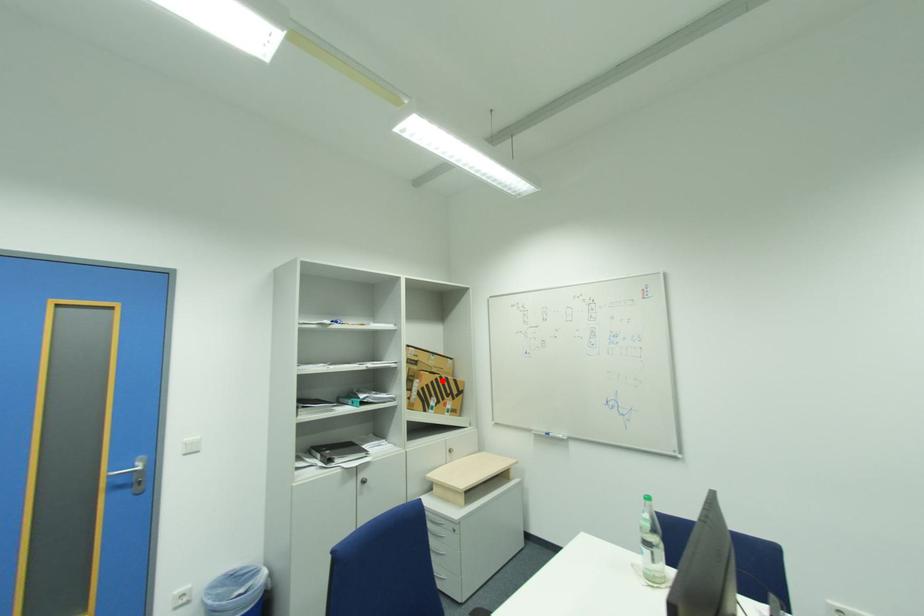
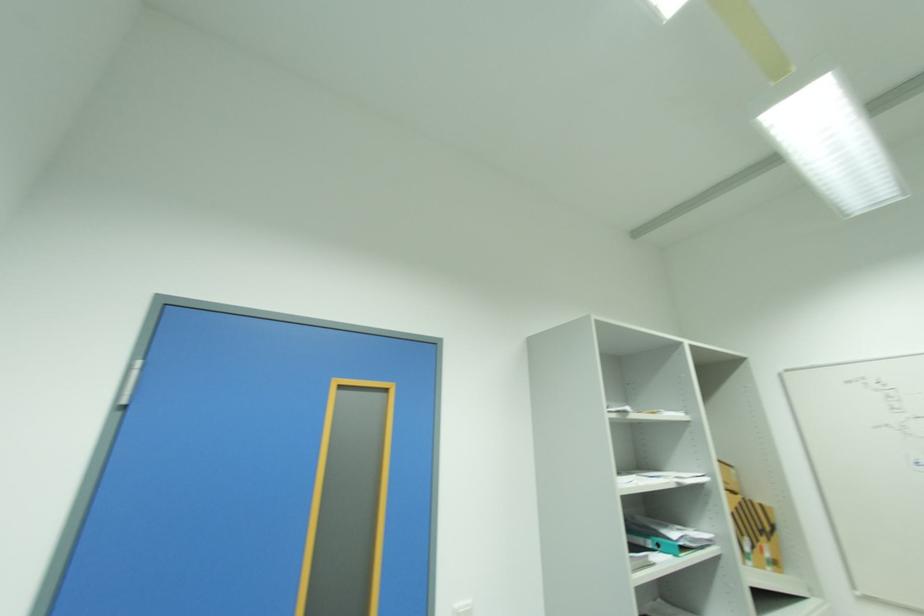
Find the pixel in the second image that matches the highlighted location in the first image.

(746, 506)